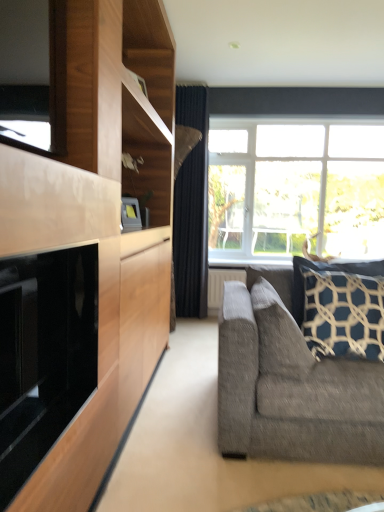
What is the approximate height of clear glass window at upper center?

clear glass window at upper center is 1.48 meters in height.

What are the coordinates of `black velvet curtain at center` in the screenshot? It's located at tap(191, 208).

This screenshot has width=384, height=512. What are the coordinates of `textured gray couch at right` in the screenshot? It's located at (290, 383).

The width and height of the screenshot is (384, 512). I want to click on pillow that is the 1st one when counting forward from the clear glass window at upper center, so click(x=340, y=307).

Between dark blue textured pillow at right, which is the second pillow in left-to-right order, and clear glass window at upper center, which one has more height?

clear glass window at upper center.

Which is more to the right, dark blue textured pillow at right, which is the second pillow in left-to-right order, or clear glass window at upper center?

Positioned to the right is clear glass window at upper center.

Is clear glass window at upper center at the left side of dark blue textured pillow at right, which ranks as the second pillow in right-to-left order?

No, clear glass window at upper center is not to the left of dark blue textured pillow at right, which ranks as the second pillow in right-to-left order.

Which of these two, clear glass window at upper center or dark blue textured pillow at right, marked as the first pillow in a left-to-right arrangement, stands taller?

With more height is clear glass window at upper center.

Looking at their sizes, would you say clear glass window at upper center is wider or thinner than dark blue textured pillow at right, marked as the first pillow in a left-to-right arrangement?

In the image, clear glass window at upper center appears to be more narrow than dark blue textured pillow at right, marked as the first pillow in a left-to-right arrangement.

Can you confirm if dark blue textured pillow at right, marked as the first pillow in a left-to-right arrangement, is thinner than textured gray couch at right?

Yes.

At what (x,y) coordinates should I click in order to perform the action: click on studio couch in front of the dark blue textured pillow at right, which ranks as the second pillow in right-to-left order. Please return your answer as a coordinate pair (x, y). Image resolution: width=384 pixels, height=512 pixels. Looking at the image, I should click on (290, 383).

Is dark blue textured pillow at right, marked as the first pillow in a left-to-right arrangement, facing towards textured gray couch at right?

A: Yes, dark blue textured pillow at right, marked as the first pillow in a left-to-right arrangement, is facing textured gray couch at right.

From a real-world perspective, who is located lower, dark blue textured pillow at right, marked as the first pillow in a left-to-right arrangement, or textured gray couch at right?

textured gray couch at right is physically lower.

Is dark blue textured pillow at right, which is counted as the 1th pillow, starting from the right, looking in the opposite direction of black velvet curtain at center?

That's not correct — dark blue textured pillow at right, which is counted as the 1th pillow, starting from the right, is not looking away from black velvet curtain at center.

Considering the positions of objects dark blue textured pillow at right, which is counted as the 1th pillow, starting from the right, and black velvet curtain at center in the image provided, who is more to the left, dark blue textured pillow at right, which is counted as the 1th pillow, starting from the right, or black velvet curtain at center?

black velvet curtain at center.

From a real-world perspective, which object rests below the other?

dark blue textured pillow at right, which is the second pillow in left-to-right order, is physically lower.

From the picture: Is dark blue textured pillow at right, which is the second pillow in left-to-right order, positioned behind black velvet curtain at center?

No, dark blue textured pillow at right, which is the second pillow in left-to-right order, is in front of black velvet curtain at center.

Which is in front, point (213, 191) or point (299, 300)?

Point (299, 300)

Is there a large distance between clear glass window at upper center and dark blue textured pillow at right, which is counted as the 1th pillow, starting from the right?

Absolutely, clear glass window at upper center is distant from dark blue textured pillow at right, which is counted as the 1th pillow, starting from the right.

From a real-world perspective, which object stands above the other?

From a 3D spatial view, clear glass window at upper center is above.

Is clear glass window at upper center looking in the opposite direction of dark blue textured pillow at right, which is counted as the 1th pillow, starting from the right?

No.

Considering the positions of objects black glass fireplace at left and dark blue textured pillow at right, marked as the first pillow in a left-to-right arrangement, in the image provided, who is more to the right, black glass fireplace at left or dark blue textured pillow at right, marked as the first pillow in a left-to-right arrangement,?

dark blue textured pillow at right, marked as the first pillow in a left-to-right arrangement, is more to the right.

Looking at this image, relative to dark blue textured pillow at right, which ranks as the second pillow in right-to-left order, is black glass fireplace at left in front or behind?

In the image, black glass fireplace at left appears in front of dark blue textured pillow at right, which ranks as the second pillow in right-to-left order.

Would you say black glass fireplace at left contains dark blue textured pillow at right, marked as the first pillow in a left-to-right arrangement?

No, dark blue textured pillow at right, marked as the first pillow in a left-to-right arrangement, is not a part of black glass fireplace at left.

From a real-world perspective, count 2nd pillows downward from the black glass fireplace at left and point to it. Please provide its 2D coordinates.

[(279, 335)]

Who is bigger, dark blue textured pillow at right, marked as the first pillow in a left-to-right arrangement, or black glass fireplace at left?

black glass fireplace at left is bigger.

Is dark blue textured pillow at right, which ranks as the second pillow in right-to-left order, positioned with its back to black glass fireplace at left?

No, dark blue textured pillow at right, which ranks as the second pillow in right-to-left order, is not facing away from black glass fireplace at left.

Which point is more forward, (x=271, y=353) or (x=33, y=453)?

The point (x=33, y=453) is more forward.

Do you think dark blue textured pillow at right, which ranks as the second pillow in right-to-left order, is within black glass fireplace at left, or outside of it?

dark blue textured pillow at right, which ranks as the second pillow in right-to-left order, is located beyond the bounds of black glass fireplace at left.

What are the coordinates of `the 1st pillow to the left of the clear glass window at upper center, counting from the anchor's position` in the screenshot? It's located at (340, 307).

Locate an element on the screen. This screenshot has width=384, height=512. window that is above the dark blue textured pillow at right, which ranks as the second pillow in right-to-left order (from a real-world perspective) is located at coordinates [x=294, y=189].

When comparing their distances from dark blue textured pillow at right, which ranks as the second pillow in right-to-left order, does dark blue textured pillow at right, which is counted as the 1th pillow, starting from the right, or black glass fireplace at left seem further?

black glass fireplace at left is further to dark blue textured pillow at right, which ranks as the second pillow in right-to-left order.

Consider the image. From the image, which object appears to be nearer to textured gray couch at right, black velvet curtain at center or clear glass window at upper center?

The object closer to textured gray couch at right is black velvet curtain at center.

Looking at the image, which one is located closer to black glass fireplace at left, dark blue textured pillow at right, which is the second pillow in left-to-right order, or textured gray couch at right?

The object closer to black glass fireplace at left is textured gray couch at right.

Estimate the real-world distances between objects in this image. Which object is further from black velvet curtain at center, clear glass window at upper center or dark blue textured pillow at right, which is the second pillow in left-to-right order?

dark blue textured pillow at right, which is the second pillow in left-to-right order.

Estimate the real-world distances between objects in this image. Which object is closer to dark blue textured pillow at right, which is the second pillow in left-to-right order, clear glass window at upper center or black glass fireplace at left?

black glass fireplace at left.

In the scene shown: Considering their positions, is black velvet curtain at center positioned further to textured gray couch at right than dark blue textured pillow at right, which ranks as the second pillow in right-to-left order?

Based on the image, black velvet curtain at center appears to be further to textured gray couch at right.

Considering their positions, is black velvet curtain at center positioned closer to dark blue textured pillow at right, marked as the first pillow in a left-to-right arrangement, than textured gray couch at right?

textured gray couch at right.

Looking at the image, which one is located closer to black velvet curtain at center, dark blue textured pillow at right, which is the second pillow in left-to-right order, or textured gray couch at right?

dark blue textured pillow at right, which is the second pillow in left-to-right order.

Image resolution: width=384 pixels, height=512 pixels. In order to click on pillow between dark blue textured pillow at right, marked as the first pillow in a left-to-right arrangement, and clear glass window at upper center from front to back in this screenshot , I will do `click(340, 307)`.

Where is `curtain between dark blue textured pillow at right, which is counted as the 1th pillow, starting from the right, and clear glass window at upper center, along the z-axis`? The image size is (384, 512). curtain between dark blue textured pillow at right, which is counted as the 1th pillow, starting from the right, and clear glass window at upper center, along the z-axis is located at coordinates (191, 208).

Locate an element on the screen. pillow positioned between dark blue textured pillow at right, which ranks as the second pillow in right-to-left order, and black velvet curtain at center from near to far is located at coordinates (340, 307).

Image resolution: width=384 pixels, height=512 pixels. I want to click on curtain between textured gray couch at right and clear glass window at upper center in the front-back direction, so click(191, 208).